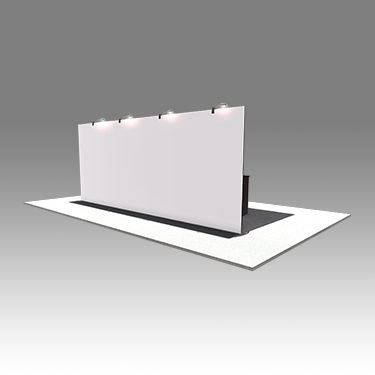
At what (x,y) coordinates should I click in order to perform the action: click on white wall. Please return your answer as a coordinate pair (x, y). This screenshot has width=375, height=375. Looking at the image, I should click on [x=168, y=156].